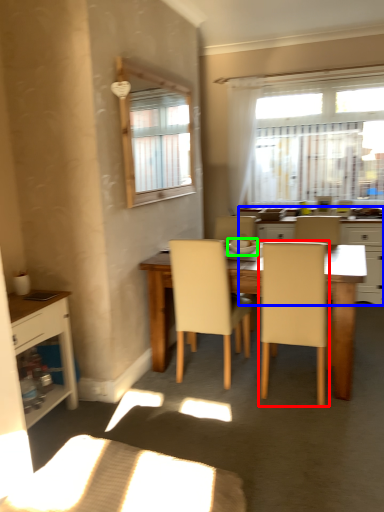
Question: Which object is positioned farthest from chair (highlighted by a red box)? Select from kitchen & dining room table (highlighted by a blue box) and tableware (highlighted by a green box).

Choices:
 (A) kitchen & dining room table
 (B) tableware

Answer: (A)